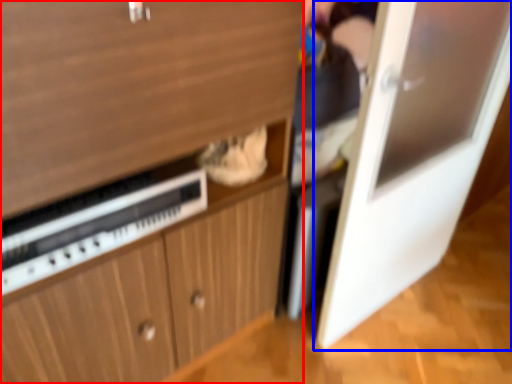
Question: Which object is further to the camera taking this photo, cabinetry (highlighted by a red box) or door (highlighted by a blue box)?

Choices:
 (A) cabinetry
 (B) door

Answer: (B)